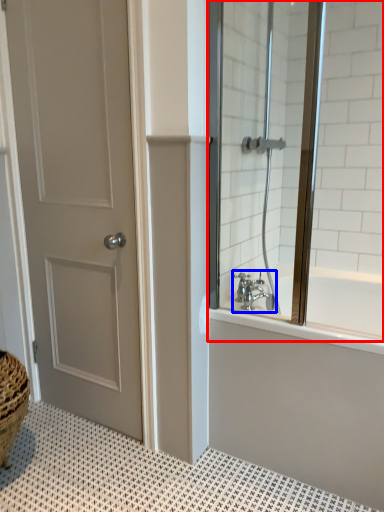
Question: Which object is further to the camera taking this photo, window screen (highlighted by a red box) or tap (highlighted by a blue box)?

Choices:
 (A) window screen
 (B) tap

Answer: (B)